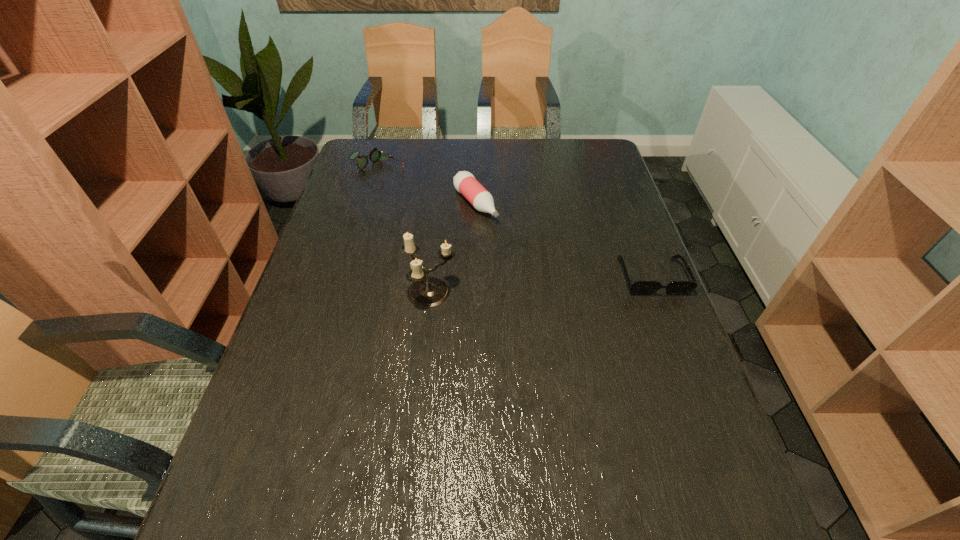
Find the location of `the tallest object`. the tallest object is located at coordinates (426, 291).

You are a GUI agent. You are given a task and a screenshot of the screen. Output one action in this format:
    pyautogui.click(x=<x>, y=<y>)
    Task: Click on the sunglasses
    The image size is (960, 540).
    Given the screenshot: What is the action you would take?
    pyautogui.click(x=638, y=287)

This screenshot has height=540, width=960. I want to click on the second farthest object, so click(464, 182).

Locate an element on the screen. This screenshot has width=960, height=540. the second tallest object is located at coordinates (464, 182).

Image resolution: width=960 pixels, height=540 pixels. Find the location of `spectacles`. spectacles is located at coordinates (375, 154).

This screenshot has width=960, height=540. Identify the location of the farthest object. (375, 154).

Where is `vacant space located on the back of the candle holder`? The height and width of the screenshot is (540, 960). vacant space located on the back of the candle holder is located at coordinates (439, 218).

I want to click on vacant space located 0.160m on the front-facing side of the rightmost object, so 680,350.

The height and width of the screenshot is (540, 960). Find the location of `vacant area situated with the cap open on the second tallest object`. vacant area situated with the cap open on the second tallest object is located at coordinates [567, 309].

This screenshot has width=960, height=540. I want to click on free spot located 0.200m with the cap open on the second tallest object, so click(x=524, y=264).